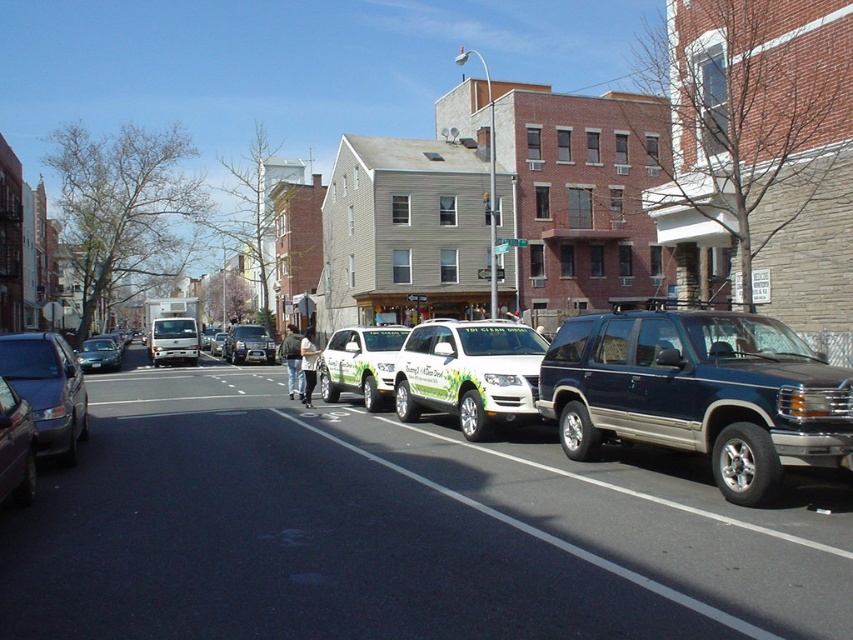
Question: Is white glossy suv at center thinner than white plastic license plate at center?

Choices:
 (A) yes
 (B) no

Answer: (B)

Question: Which object is closer to the camera taking this photo?

Choices:
 (A) white glossy van at center
 (B) white glossy suv at center
 (C) shiny dark gray sedan at left

Answer: (C)

Question: Estimate the real-world distances between objects in this image. Which object is closer to the shiny silver car at center?

Choices:
 (A) green and white suv at center
 (B) white glossy van at center
 (C) green matte van at center
 (D) white plastic license plate at center

Answer: (C)

Question: Does shiny silver car at center have a lesser width compared to green matte van at center?

Choices:
 (A) yes
 (B) no

Answer: (A)

Question: Based on their relative distances, which object is nearer to the shiny dark gray sedan at left?

Choices:
 (A) white glossy van at center
 (B) green and white suv at center

Answer: (B)

Question: Is green matte van at center above white glossy van at center?

Choices:
 (A) yes
 (B) no

Answer: (B)